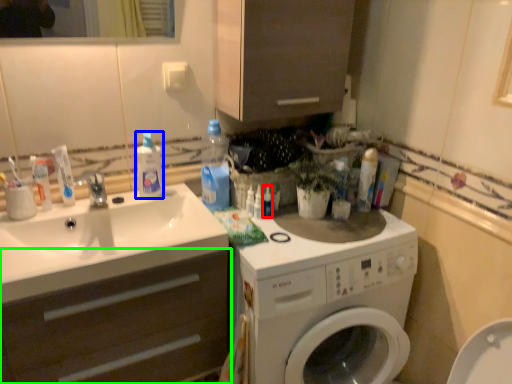
Question: Which object is the farthest from toiletry (highlighted by a red box)? Choose among these: cleaning product (highlighted by a blue box) or bathroom cabinet (highlighted by a green box).

Choices:
 (A) cleaning product
 (B) bathroom cabinet

Answer: (B)